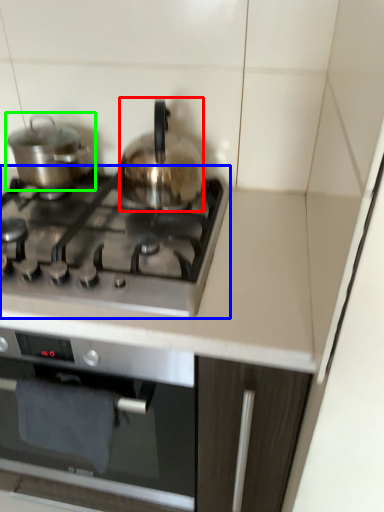
Question: Which is nearer to the kitchen appliance (highlighted by a red box)? gas stove (highlighted by a blue box) or kitchen appliance (highlighted by a green box).

Choices:
 (A) gas stove
 (B) kitchen appliance

Answer: (A)